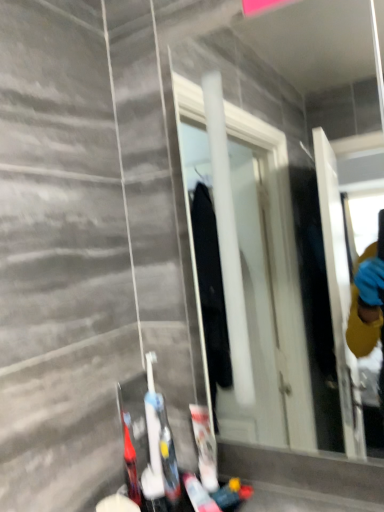
Question: From the image's perspective, is white plastic toothbrush at lower center, the second toiletry in the right-to-left sequence, located above or below translucent plastic toothbrush at lower left, which is the third toiletry from right to left?

Choices:
 (A) above
 (B) below

Answer: (A)

Question: In the image, is white plastic toothbrush at lower center, the second toiletry in the right-to-left sequence, on the left side or the right side of translucent plastic toothbrush at lower left, the first toiletry positioned from the left?

Choices:
 (A) right
 (B) left

Answer: (A)

Question: Which object is positioned farthest from the white matte toothpaste tube at lower center, which is counted as the 1th toiletry, starting from the right?

Choices:
 (A) white glossy mirror at center
 (B) translucent plastic toothbrush at lower left, the first toiletry positioned from the left
 (C) white plastic toothbrush at lower center, the second toiletry in the right-to-left sequence

Answer: (A)

Question: Which object is the closest to the white plastic toothbrush at lower center, the second toiletry from the left?

Choices:
 (A) white matte toothpaste tube at lower center, placed as the 3th toiletry when sorted from left to right
 (B) white glossy mirror at center
 (C) translucent plastic toothbrush at lower left, which is the third toiletry from right to left

Answer: (C)